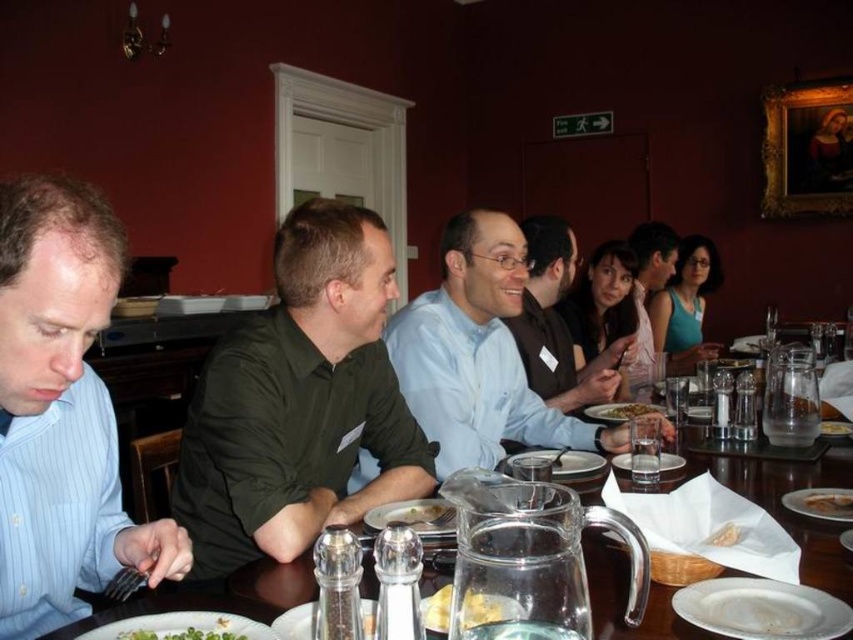
Question: Among these points, which one is farthest from the camera?

Choices:
 (A) (129, 637)
 (B) (486, 598)
 (C) (16, 312)
 (D) (445, 525)

Answer: (D)

Question: Does green matte shirt at center appear on the left side of green leafy vegetables at center?

Choices:
 (A) yes
 (B) no

Answer: (B)

Question: Can you confirm if blue striped shirt at left is positioned below yellow crumbly bread at center?

Choices:
 (A) yes
 (B) no

Answer: (B)

Question: Which point is farther to the camera?

Choices:
 (A) (833, 433)
 (B) (822, 508)
 (C) (428, 518)

Answer: (A)

Question: Can you confirm if green matte shirt at center is positioned below clear glass pitcher at center?

Choices:
 (A) yes
 (B) no

Answer: (B)

Question: Based on their relative distances, which object is nearer to the light blue shirt at center?

Choices:
 (A) green leafy vegetables at center
 (B) golden crispy bread at center
 (C) clear glass pitcher at center
 (D) green matte shirt at center

Answer: (D)